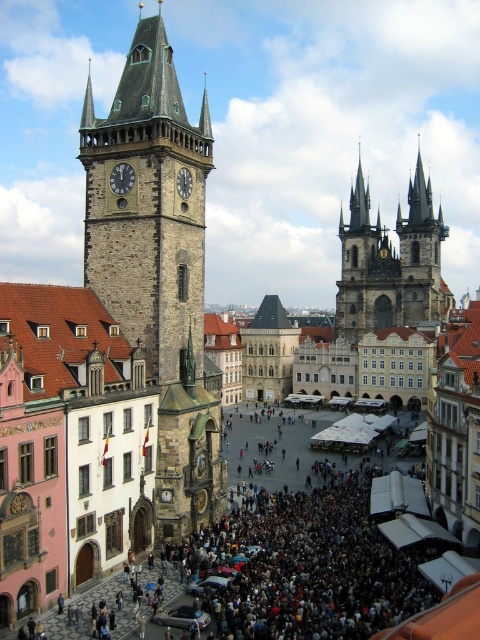
In the scene shown: Does matte stone clock tower at upper left appear on the left side of dark gray stone clock at center?

Indeed, matte stone clock tower at upper left is positioned on the left side of dark gray stone clock at center.

Is matte stone clock tower at upper left positioned behind dark gray stone clock at center?

No, matte stone clock tower at upper left is in front of dark gray stone clock at center.

Which is in front, point (122, 192) or point (177, 176)?

Point (122, 192)

Image resolution: width=480 pixels, height=640 pixels. I want to click on matte stone clock tower at upper left, so click(121, 179).

Is stone clock tower at left above golden stone spires at upper right?

Indeed, stone clock tower at left is positioned over golden stone spires at upper right.

Does stone clock tower at left appear on the left side of golden stone spires at upper right?

Indeed, stone clock tower at left is positioned on the left side of golden stone spires at upper right.

Does point (168, 44) come in front of point (362, 324)?

Yes, it is in front of point (362, 324).

At what (x,y) coordinates should I click in order to perform the action: click on stone clock tower at left. Please return your answer as a coordinate pair (x, y). The height and width of the screenshot is (640, 480). Looking at the image, I should click on (148, 205).

Does golden stone spires at upper right have a lesser width compared to matte stone clock tower at upper left?

No, golden stone spires at upper right is not thinner than matte stone clock tower at upper left.

In the scene shown: Which is more to the right, golden stone spires at upper right or matte stone clock tower at upper left?

Positioned to the right is golden stone spires at upper right.

Identify the location of golden stone spires at upper right. (388, 262).